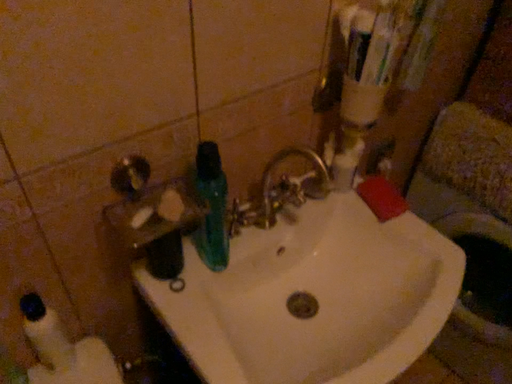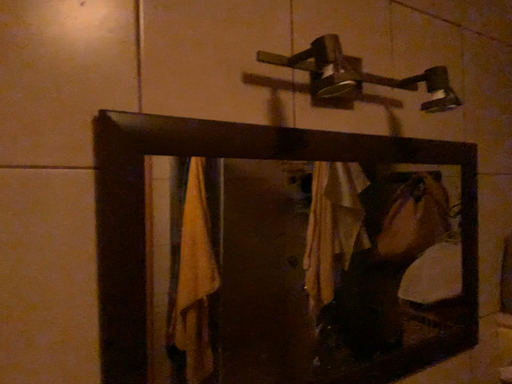
Question: How did the camera likely rotate when shooting the video?

Choices:
 (A) rotated upward
 (B) rotated downward

Answer: (A)